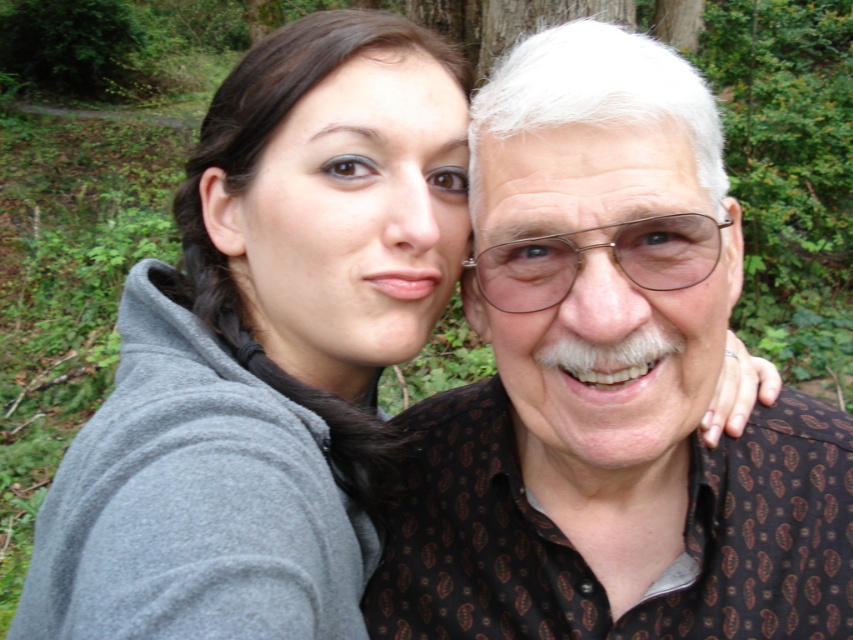
Is brown patterned shirt at center smaller than metallic wireframe glasses at center?

No.

Is point (590, 324) positioned in front of point (711, 244)?

Yes, point (590, 324) is closer to viewer.

Which is in front, point (570, 493) or point (489, 296)?

Positioned in front is point (489, 296).

Where is `brown patterned shirt at center`? The width and height of the screenshot is (853, 640). brown patterned shirt at center is located at coordinates (608, 385).

Does gray fleece jacket at upper left come behind metallic wireframe glasses at center?

No, it is not.

Does point (257, 500) come behind point (573, 253)?

That is False.

At what (x,y) coordinates should I click in order to perform the action: click on gray fleece jacket at upper left. Please return your answer as a coordinate pair (x, y). The image size is (853, 640). Looking at the image, I should click on (265, 349).

Is brown patterned shirt at center further to the viewer compared to gray fleece jacket at upper left?

Yes, it is.

Does point (659, 243) come in front of point (189, 298)?

Yes, point (659, 243) is in front of point (189, 298).

Between point (592, 68) and point (450, 147), which one is positioned in front?

Positioned in front is point (592, 68).

I want to click on brown patterned shirt at center, so click(608, 385).